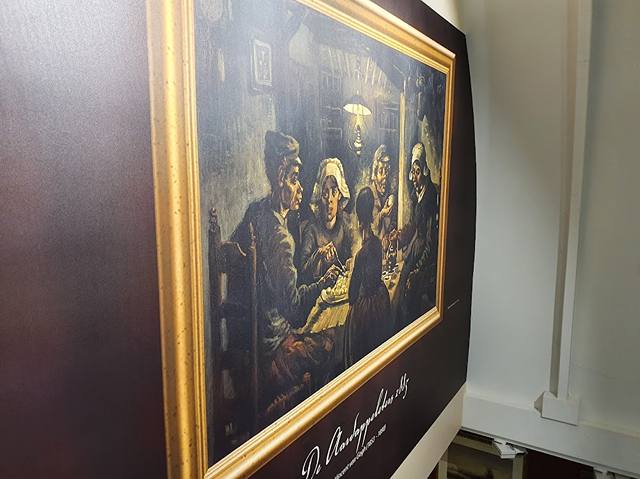
Locate an element on the screen. tops of back of chair is located at coordinates (211, 211), (250, 222).